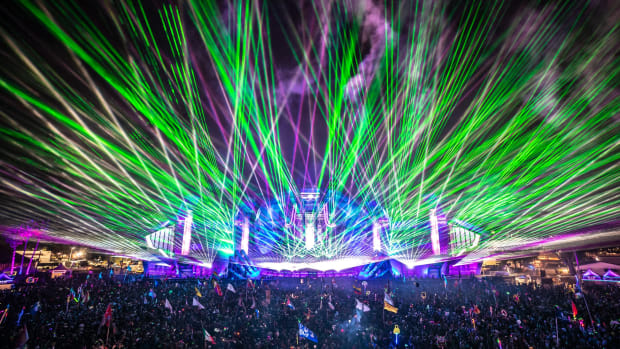
Find the location of a particular element. Image resolution: width=620 pixels, height=349 pixels. support pillars is located at coordinates (32, 256), (12, 256).